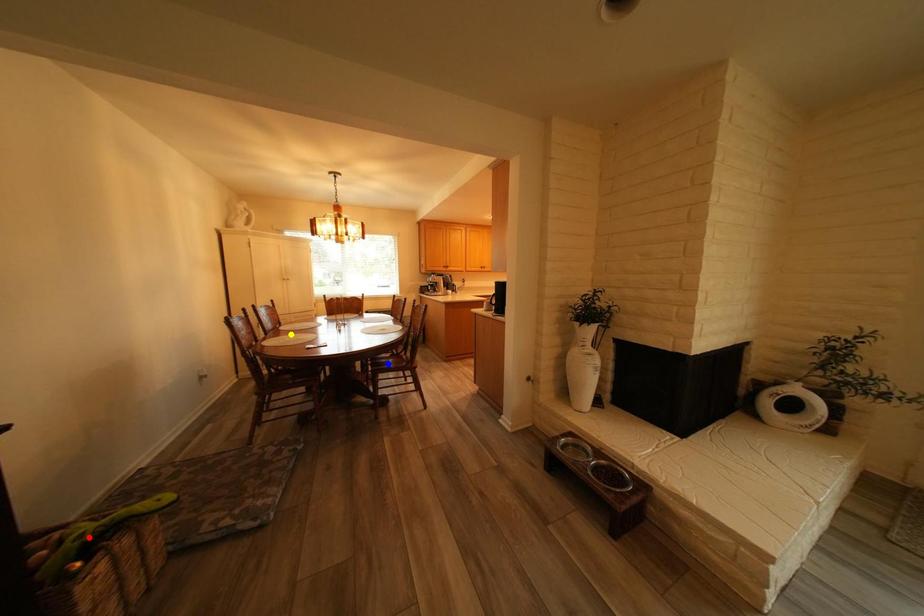
Order these from nearest to farthest:
A) yellow point
B) red point
C) blue point

yellow point
blue point
red point